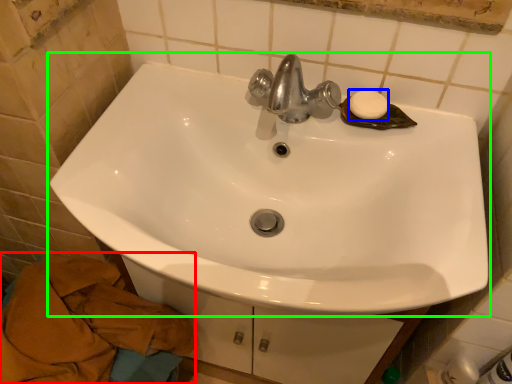
Question: Which is farther away from bath towel (highlighted by a red box)? soap (highlighted by a blue box) or sink (highlighted by a green box)?

Choices:
 (A) soap
 (B) sink

Answer: (A)